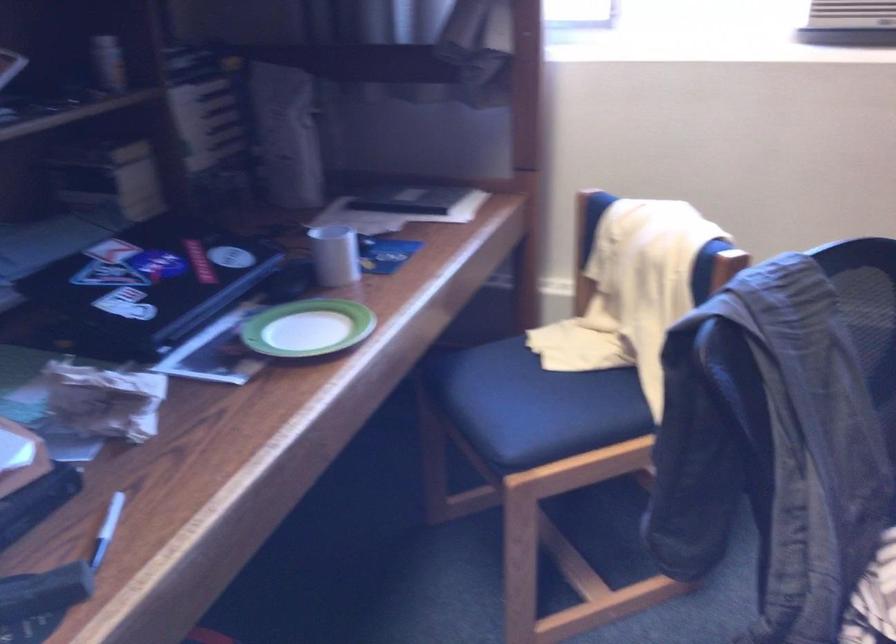
Describe the element at coordinates (728, 263) in the screenshot. I see `a black chair armrest` at that location.